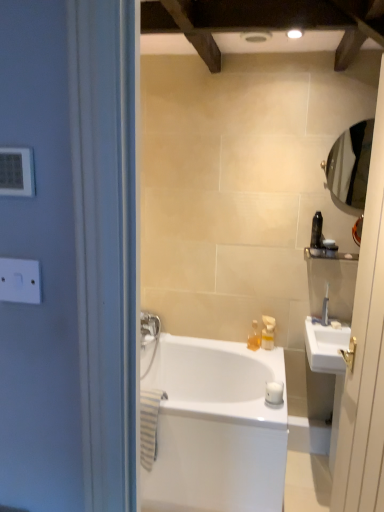
The width and height of the screenshot is (384, 512). What do you see at coordinates (330, 248) in the screenshot? I see `matte black toothbrush at upper right, marked as the second toiletry in a front-to-back arrangement` at bounding box center [330, 248].

I want to click on satin nickel faucet at upper right, so click(x=325, y=308).

The height and width of the screenshot is (512, 384). Describe the element at coordinates (216, 428) in the screenshot. I see `white glossy bathtub at center` at that location.

In order to face translucent plastic bottles at upper center, the third toiletry when ordered from front to back, should I rotate leftwards or rightwards?

Turn right by 8.650 degrees to look at translucent plastic bottles at upper center, the third toiletry when ordered from front to back.

Describe the element at coordinates (350, 164) in the screenshot. I see `silver metallic mirror at upper right` at that location.

Image resolution: width=384 pixels, height=512 pixels. I want to click on matte black toothbrush at upper right, the second toiletry in the bottom-to-top sequence, so click(330, 248).

In terms of width, does clear glass mirror at right look wider or thinner when compared to satin nickel faucet at upper right?

Considering their sizes, clear glass mirror at right looks broader than satin nickel faucet at upper right.

Is clear glass mirror at right in contact with satin nickel faucet at upper right?

No, clear glass mirror at right is not with satin nickel faucet at upper right.

From a real-world perspective, between clear glass mirror at right and satin nickel faucet at upper right, who is vertically higher?

clear glass mirror at right is physically above.

From the image's perspective, is clear glass mirror at right located beneath satin nickel faucet at upper right?

Incorrect, from the image's perspective, clear glass mirror at right is higher than satin nickel faucet at upper right.

Which point is more distant from viewer, (0, 181) or (7, 276)?

The point (7, 276) is farther from the camera.

Between white plastic light switch at upper left and white plastic switch at upper left, which one has smaller size?

white plastic light switch at upper left.

Choose the correct answer: Is white plastic light switch at upper left inside white plastic switch at upper left or outside it?

white plastic light switch at upper left is not enclosed by white plastic switch at upper left.

Who is taller, white plastic light switch at upper left or white plastic switch at upper left?

white plastic switch at upper left.

Is white plastic light switch at upper left positioned in front of matte black toothbrush at upper right, the second toiletry from the back?

Yes, it is in front of matte black toothbrush at upper right, the second toiletry from the back.

Who is shorter, white plastic light switch at upper left or matte black toothbrush at upper right, the second toiletry from the back?

Standing shorter between the two is matte black toothbrush at upper right, the second toiletry from the back.

Is white plastic light switch at upper left in contact with matte black toothbrush at upper right, marked as the second toiletry in a front-to-back arrangement?

There is a gap between white plastic light switch at upper left and matte black toothbrush at upper right, marked as the second toiletry in a front-to-back arrangement.

Can you tell me how much white plastic light switch at upper left and matte black toothbrush at upper right, positioned as the second toiletry in top-to-bottom order, differ in facing direction?

There is a 0.302-degree angle between the facing directions of white plastic light switch at upper left and matte black toothbrush at upper right, positioned as the second toiletry in top-to-bottom order.

In the scene shown: Would you say silver metallic mirror at upper right is a long distance from matte black toothbrush at upper right, positioned as the second toiletry in top-to-bottom order?

silver metallic mirror at upper right is actually quite close to matte black toothbrush at upper right, positioned as the second toiletry in top-to-bottom order.

In the scene shown: Is silver metallic mirror at upper right thinner than matte black toothbrush at upper right, acting as the 1th toiletry starting from the right?

No.

Is silver metallic mirror at upper right not within matte black toothbrush at upper right, the second toiletry from the back?

Indeed, silver metallic mirror at upper right is completely outside matte black toothbrush at upper right, the second toiletry from the back.

Could you tell me if white plastic light switch at upper left is turned towards white glossy bathtub at center?

No, white plastic light switch at upper left is not turned towards white glossy bathtub at center.

Who is taller, white plastic light switch at upper left or white glossy bathtub at center?

white glossy bathtub at center.

From a real-world perspective, which object stands above the other?

In real-world perspective, white plastic light switch at upper left is above.

Is white plastic light switch at upper left in front of white glossy bathtub at center?

Yes, white plastic light switch at upper left is closer to the viewer.

Is point (255, 321) closer to camera compared to point (365, 475)?

No, (255, 321) is further to viewer.

From a real-world perspective, is translucent plastic bottles at upper center, the 1th toiletry viewed from the back, located beneath clear glass mirror at right?

Correct, in the physical world, translucent plastic bottles at upper center, the 1th toiletry viewed from the back, is lower than clear glass mirror at right.

Looking at this image, between translucent plastic bottles at upper center, which ranks as the 1th toiletry in left-to-right order, and clear glass mirror at right, which one has more height?

Standing taller between the two is clear glass mirror at right.

Is translucent plastic bottles at upper center, the 1th toiletry viewed from the back, next to clear glass mirror at right and touching it?

translucent plastic bottles at upper center, the 1th toiletry viewed from the back, and clear glass mirror at right are not in contact.

Find the location of a particular element. The height and width of the screenshot is (512, 384). toiletry that is the 3rd one when counting backward from the white plastic switch at upper left is located at coordinates (254, 337).

Does white plastic switch at upper left turn towards translucent plastic bottles at upper center, which ranks as the 1th toiletry in left-to-right order?

No, white plastic switch at upper left is not oriented towards translucent plastic bottles at upper center, which ranks as the 1th toiletry in left-to-right order.

Which object is thinner, white plastic switch at upper left or translucent plastic bottles at upper center, the 3th toiletry positioned from the top?

white plastic switch at upper left is thinner.

Is white plastic switch at upper left far from translucent plastic bottles at upper center, which ranks as the 1th toiletry in left-to-right order?

Absolutely, white plastic switch at upper left is distant from translucent plastic bottles at upper center, which ranks as the 1th toiletry in left-to-right order.

At what (x,y) coordinates should I click in order to perform the action: click on screen door positioned vertically above the satin nickel faucet at upper right (from a real-world perspective). Please return your answer as a coordinate pair (x, y). Image resolution: width=384 pixels, height=512 pixels. Looking at the image, I should click on (366, 354).

What are the coordinates of `electric outlet on the left side of white plastic light switch at upper left` in the screenshot? It's located at (20, 280).

Which object lies further to the anchor point white plastic switch at upper left, clear glass mirror at right or matte black toothbrush at upper right, positioned as the 3th toiletry in left-to-right order?

matte black toothbrush at upper right, positioned as the 3th toiletry in left-to-right order, is positioned further to the anchor white plastic switch at upper left.

When comparing their distances from clear glass mirror at right, does white plastic light switch at upper left or white matte toilet paper at center seem further?

Among the two, white plastic light switch at upper left is located further to clear glass mirror at right.

When comparing their distances from translucent plastic bottles at upper center, the 3th toiletry positioned from the top, does silver metallic mirror at upper right or satin nickel faucet at upper right seem closer?

Based on the image, satin nickel faucet at upper right appears to be nearer to translucent plastic bottles at upper center, the 3th toiletry positioned from the top.

Estimate the real-world distances between objects in this image. Which object is closer to clear glass mirror at right, matte black toothbrush at upper right, marked as the second toiletry in a front-to-back arrangement, or white plastic light switch at upper left?

matte black toothbrush at upper right, marked as the second toiletry in a front-to-back arrangement, lies closer to clear glass mirror at right than the other object.

Looking at the image, which one is located further to white plastic switch at upper left, black plastic toothbrush at right, which ranks as the second toiletry in left-to-right order, or white plastic light switch at upper left?

black plastic toothbrush at right, which ranks as the second toiletry in left-to-right order, is positioned further to the anchor white plastic switch at upper left.

Based on their spatial positions, is satin nickel faucet at upper right or white plastic switch at upper left closer to clear glass mirror at right?

satin nickel faucet at upper right.

Based on their spatial positions, is silver metallic mirror at upper right or black plastic toothbrush at right, which is counted as the 3th toiletry, starting from the back, closer to translucent plastic bottles at upper center, which appears as the third toiletry when viewed from the right?

black plastic toothbrush at right, which is counted as the 3th toiletry, starting from the back.

Considering their positions, is white plastic light switch at upper left positioned closer to white glossy bathtub at center than white matte toilet paper at center?

The object closer to white glossy bathtub at center is white matte toilet paper at center.

At what (x,y) coordinates should I click in order to perform the action: click on faucet between white matte toilet paper at center and translucent plastic bottles at upper center, the 1th toiletry positioned from the bottom, in the front-back direction. Please return your answer as a coordinate pair (x, y). Looking at the image, I should click on (325, 308).

What are the coordinates of `bathtub between white plastic switch at upper left and satin nickel faucet at upper right from front to back` in the screenshot? It's located at (216, 428).

The width and height of the screenshot is (384, 512). Identify the location of faucet between clear glass mirror at right and translucent plastic bottles at upper center, the third toiletry when ordered from front to back, in the front-back direction. (325, 308).

Find the location of `electric outlet located between white plastic light switch at upper left and white matte toilet paper at center in the depth direction`. electric outlet located between white plastic light switch at upper left and white matte toilet paper at center in the depth direction is located at coordinates (20, 280).